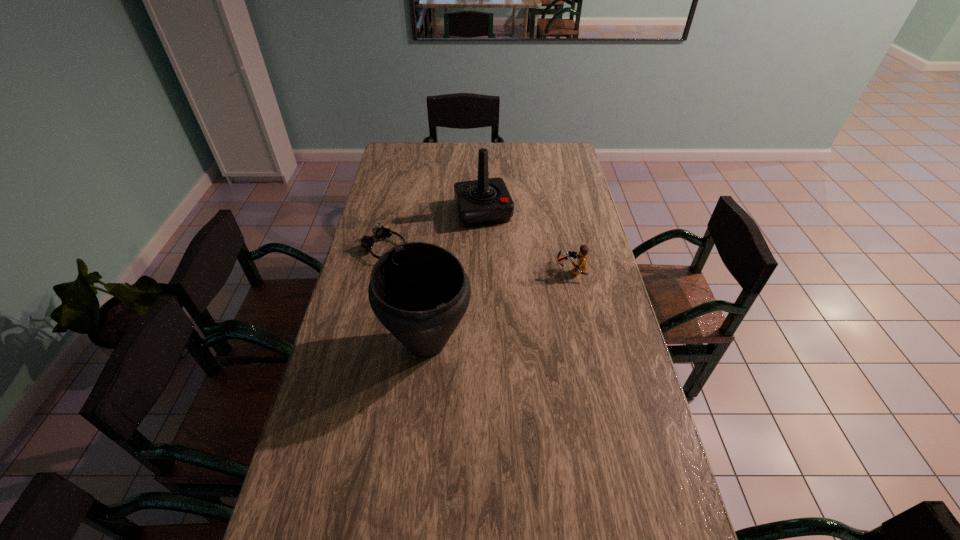
In order to click on object that stands as the closest to the Lego in this screenshot , I will do `click(486, 201)`.

Locate an element on the screen. This screenshot has width=960, height=540. vacant region that satisfies the following two spatial constraints: 1. on the back side of the joystick; 2. on the left side of the goggles is located at coordinates (394, 212).

This screenshot has width=960, height=540. I want to click on free space that satisfies the following two spatial constraints: 1. on the front side of the rightmost object; 2. holding a crossbow in the hands of the joystick, so click(x=484, y=270).

This screenshot has width=960, height=540. In order to click on free location that satisfies the following two spatial constraints: 1. on the back side of the urn; 2. holding a crossbow in the hands of the third tallest object in this screenshot , I will do `click(435, 270)`.

Identify the location of free space that satisfies the following two spatial constraints: 1. on the front side of the second shortest object; 2. holding a crossbow in the hands of the farthest object. This screenshot has width=960, height=540. (484, 270).

Locate an element on the screen. The width and height of the screenshot is (960, 540). free point that satisfies the following two spatial constraints: 1. on the front side of the Lego; 2. holding a crossbow in the hands of the shortest object is located at coordinates (380, 270).

This screenshot has width=960, height=540. I want to click on blank area in the image that satisfies the following two spatial constraints: 1. on the front side of the shortest object; 2. holding a crossbow in the hands of the rightmost object, so click(380, 270).